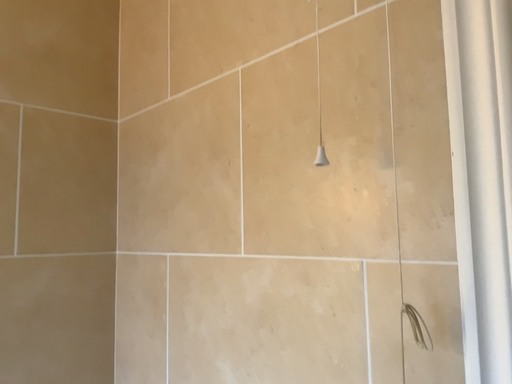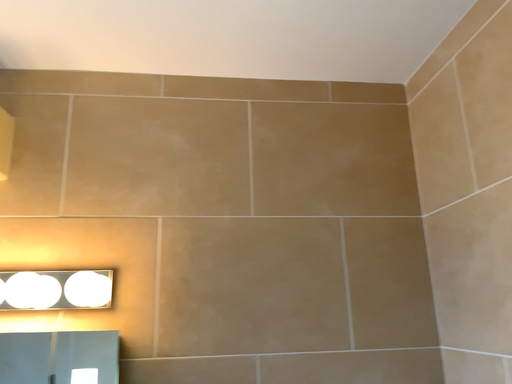
Question: How did the camera likely rotate when shooting the video?

Choices:
 (A) rotated right
 (B) rotated left

Answer: (B)